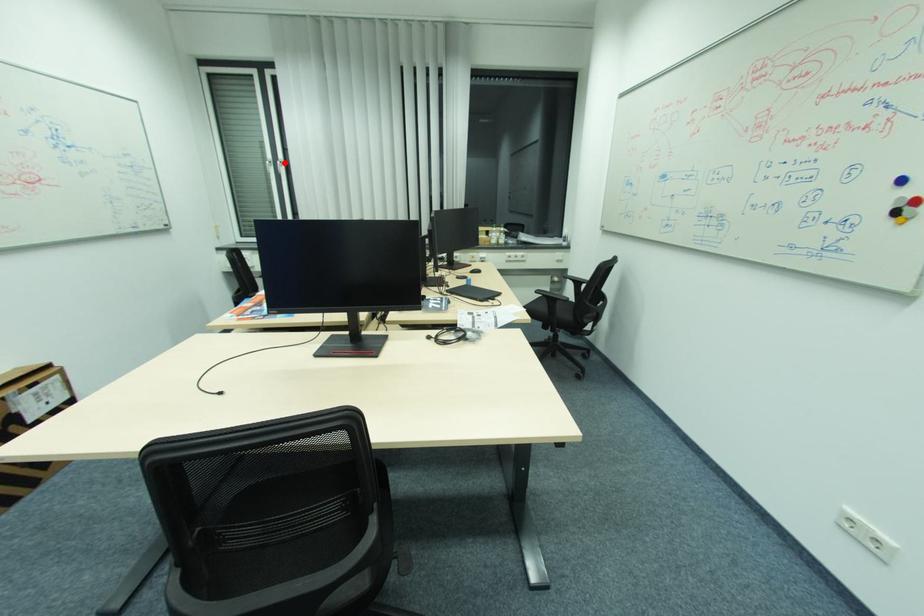
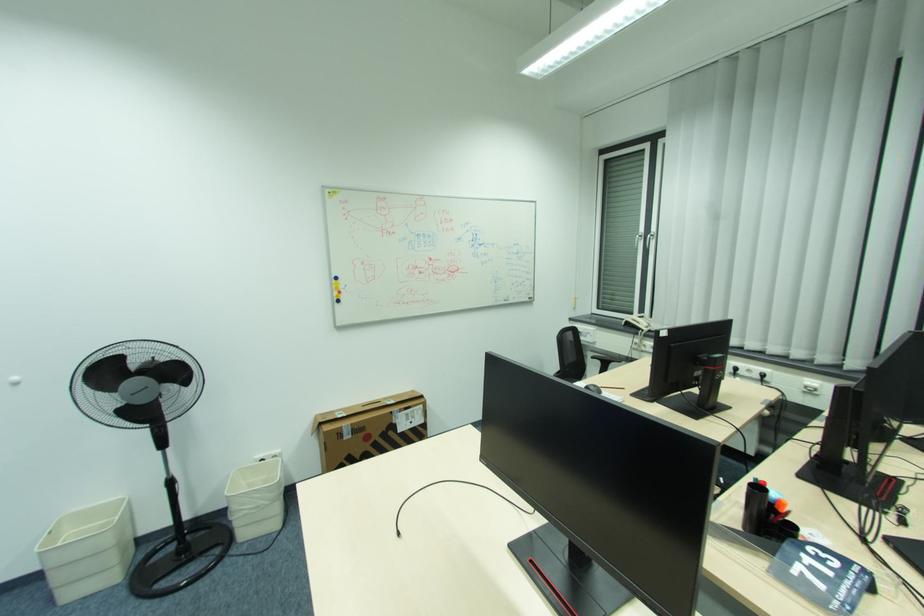
Find the pixel in the second image that matches the highlighted location in the first image.

(653, 236)